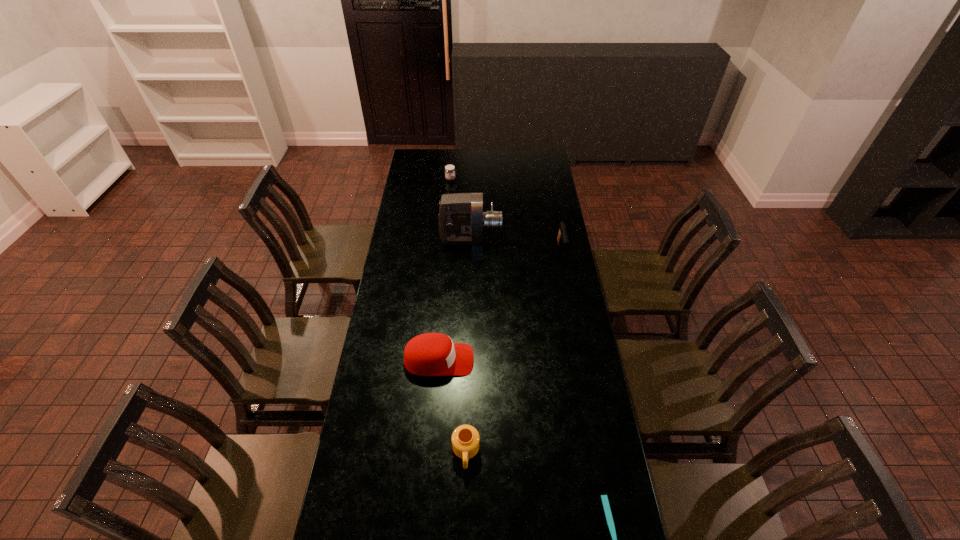
Find the location of a particular element. vacant region between the pistol and the jam is located at coordinates (506, 215).

Find the location of a particular element. This screenshot has width=960, height=540. vacant space in between the fourth shortest object and the pistol is located at coordinates coord(500,306).

What are the coordinates of `object that can be found as the closest to the spoon` in the screenshot? It's located at (465, 439).

Where is `object that stands as the fourth closest to the fourth farthest object`? The image size is (960, 540). object that stands as the fourth closest to the fourth farthest object is located at coordinates (562, 238).